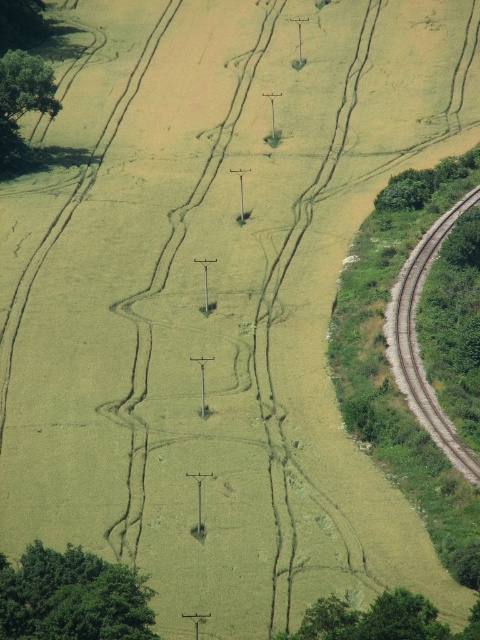
You are a surveyor using a coordinate system where the bottom left corner is the origin. You need to locate the brown gravel train track at right. What are its coordinates?

The coordinates of the brown gravel train track at right are at point (418, 342).

You are a bird flying over the rural landscape. You see the green leafy tree at lower left and the brown gravel train track at right. Which object is closer to the ground?

The green leafy tree at lower left is positioned under the brown gravel train track at right, so the tree is closer to the ground.

You are a drone operator flying over a rural area. You need to determine the relative positions of two points marked on your map. The first point is labeled as point (4, 97) and the second is point (404, 188). Based on the image, which point is closer to your current position?

Point (4, 97) is closer to the viewer than point (404, 188).